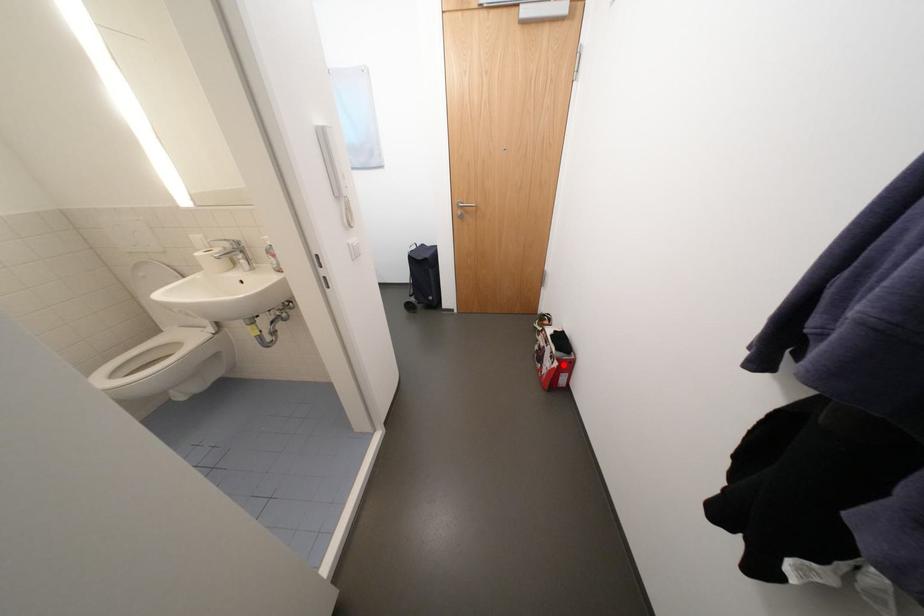
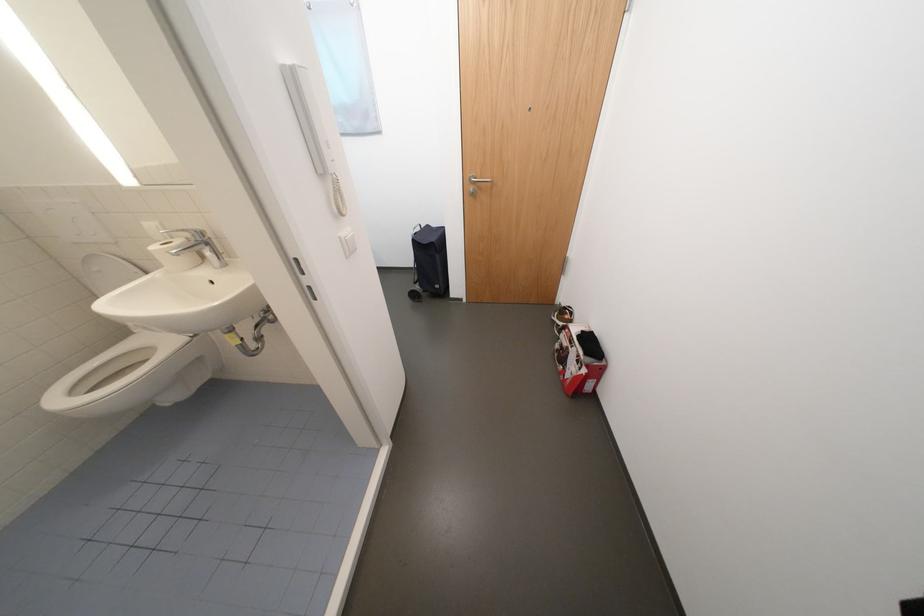
Question: I am providing you with two images of the same scene from different viewpoints. A red point is shown in image1. For the corresponding object point in image2, is it positioned nearer or farther from the camera?

Choices:
 (A) Nearer
 (B) Farther

Answer: (A)